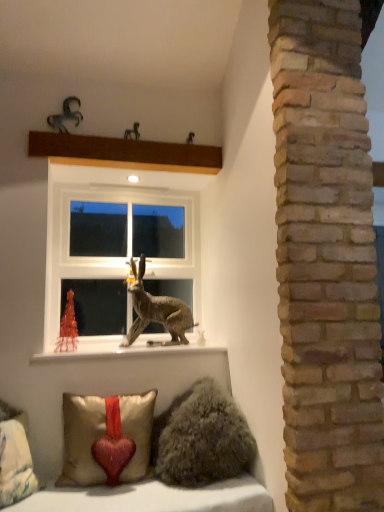
Question: Would you say satin gold pillow with red heart at lower left, the second pillow from the left, is outside metallic horse at upper left, the second animal positioned from the front?

Choices:
 (A) yes
 (B) no

Answer: (A)

Question: From a real-world perspective, is satin gold pillow with red heart at lower left, the first pillow positioned from the right, below metallic horse at upper left, the first animal viewed from the top?

Choices:
 (A) no
 (B) yes

Answer: (B)

Question: Is satin gold pillow with red heart at lower left, the second pillow from the left, behind metallic horse at upper left, the second animal positioned from the front?

Choices:
 (A) no
 (B) yes

Answer: (A)

Question: From a real-world perspective, is satin gold pillow with red heart at lower left, the first pillow positioned from the right, located higher than metallic horse at upper left, arranged as the 4th animal when viewed from the right?

Choices:
 (A) yes
 (B) no

Answer: (B)

Question: Can you confirm if satin gold pillow with red heart at lower left, the first pillow positioned from the right, is wider than metallic horse at upper left, which is counted as the third animal, starting from the back?

Choices:
 (A) no
 (B) yes

Answer: (B)

Question: From the image's perspective, is velvet beige pillow with red heart at lower left, arranged as the 1th pillow when viewed from the left, above or below satin gold pillow with red heart at lower left, the second pillow from the left?

Choices:
 (A) below
 (B) above

Answer: (A)

Question: From a real-world perspective, is velvet beige pillow with red heart at lower left, which appears as the 2th pillow when viewed from the right, above or below satin gold pillow with red heart at lower left, the second pillow from the left?

Choices:
 (A) above
 (B) below

Answer: (B)

Question: Relative to satin gold pillow with red heart at lower left, the first pillow positioned from the right, is velvet beige pillow with red heart at lower left, which appears as the 2th pillow when viewed from the right, in front or behind?

Choices:
 (A) front
 (B) behind

Answer: (A)

Question: From their relative heights in the image, would you say velvet beige pillow with red heart at lower left, arranged as the 1th pillow when viewed from the left, is taller or shorter than satin gold pillow with red heart at lower left, the second pillow from the left?

Choices:
 (A) short
 (B) tall

Answer: (B)

Question: Is white glossy window sill at lower center inside or outside of satin gold pillow with red heart at lower left, the second pillow from the left?

Choices:
 (A) outside
 (B) inside

Answer: (A)

Question: Considering the positions of white glossy window sill at lower center and satin gold pillow with red heart at lower left, the first pillow positioned from the right, in the image, is white glossy window sill at lower center wider or thinner than satin gold pillow with red heart at lower left, the first pillow positioned from the right,?

Choices:
 (A) wide
 (B) thin

Answer: (A)

Question: In the image, is white glossy window sill at lower center on the left side or the right side of satin gold pillow with red heart at lower left, the second pillow from the left?

Choices:
 (A) right
 (B) left

Answer: (A)

Question: From a real-world perspective, relative to satin gold pillow with red heart at lower left, the first pillow positioned from the right, is white glossy window sill at lower center vertically above or below?

Choices:
 (A) below
 (B) above

Answer: (B)

Question: Considering the positions of white plastic window at center and metallic brown rabbit at center, placed as the third animal when sorted from front to back, in the image, is white plastic window at center bigger or smaller than metallic brown rabbit at center, placed as the third animal when sorted from front to back,?

Choices:
 (A) small
 (B) big

Answer: (B)

Question: Is white plastic window at center wider or thinner than metallic brown rabbit at center, placed as the third animal when sorted from front to back?

Choices:
 (A) wide
 (B) thin

Answer: (B)